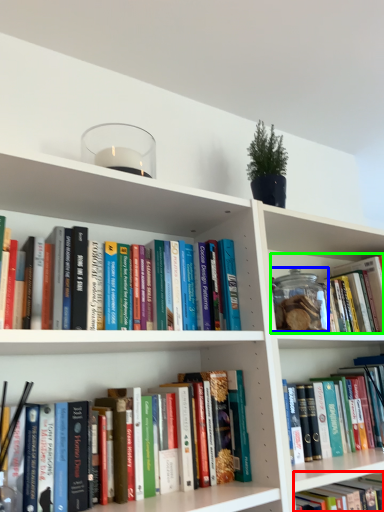
Question: Which is nearer to the book (highlighted by a red box)? glass jar (highlighted by a blue box) or book (highlighted by a green box).

Choices:
 (A) glass jar
 (B) book

Answer: (A)